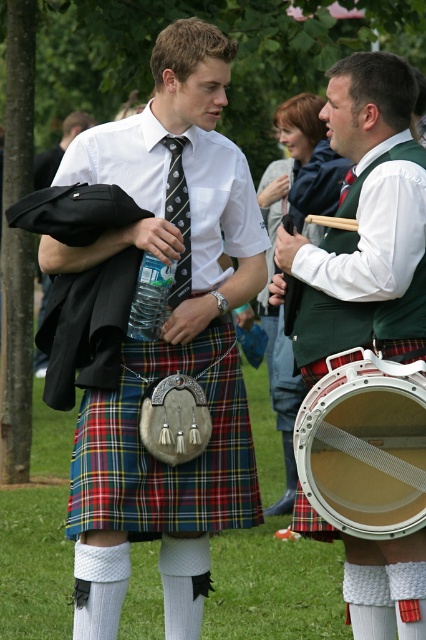
Between plaid fabric kilt at center and black silk tie at center, which one is positioned lower?

Positioned lower is plaid fabric kilt at center.

Is point (123, 352) more distant than point (351, 180)?

No, it is not.

The image size is (426, 640). I want to click on plaid fabric kilt at center, so point(163,465).

Which of these two, matte black tie at center or black textured tie at center, stands shorter?

black textured tie at center

Is matte black tie at center thinner than black textured tie at center?

No.

Which is behind, point (152, 54) or point (178, 156)?

Point (152, 54)

At what (x,y) coordinates should I click in order to perform the action: click on matte black tie at center. Please return your answer as a coordinate pair (x, y). This screenshot has height=640, width=426. Looking at the image, I should click on (166, 342).

Image resolution: width=426 pixels, height=640 pixels. What do you see at coordinates (354, 456) in the screenshot?
I see `white mesh drum at center` at bounding box center [354, 456].

Is white mesh drum at center thinner than matte black jacket at left?

Indeed, white mesh drum at center has a lesser width compared to matte black jacket at left.

At what (x,y) coordinates should I click in order to perform the action: click on white mesh drum at center. Please return your answer as a coordinate pair (x, y). The height and width of the screenshot is (640, 426). Looking at the image, I should click on (354, 456).

This screenshot has height=640, width=426. I want to click on white mesh drum at center, so click(x=354, y=456).